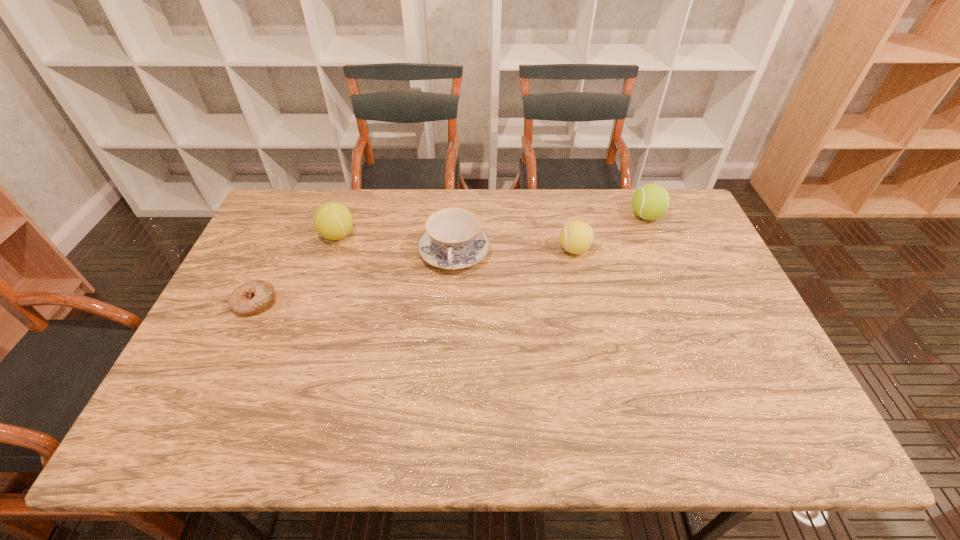
I want to click on vacant space in between the second object from left to right and the rightmost object, so click(x=492, y=226).

The image size is (960, 540). I want to click on blank region between the fourth object from left to right and the leftmost object, so (415, 276).

The width and height of the screenshot is (960, 540). Identify the location of vacant point located between the second tennis ball from right to left and the rightmost object. (610, 233).

You are a GUI agent. You are given a task and a screenshot of the screen. Output one action in this format:
    pyautogui.click(x=<x>, y=<y>)
    Task: Click on the empty space between the second object from right to left and the shortest object
    The image size is (960, 540).
    Given the screenshot: What is the action you would take?
    pyautogui.click(x=415, y=276)

This screenshot has width=960, height=540. Find the location of `free area in between the fourth object from right to left and the third object from left to right`. free area in between the fourth object from right to left and the third object from left to right is located at coordinates (396, 244).

You are a GUI agent. You are given a task and a screenshot of the screen. Output one action in this format:
    pyautogui.click(x=<x>, y=<y>)
    Task: Click on the vacant space that is in between the leftmost object and the fourth object from left to right
    Image resolution: width=960 pixels, height=540 pixels.
    Given the screenshot: What is the action you would take?
    pyautogui.click(x=415, y=276)

Locate an element on the screen. The height and width of the screenshot is (540, 960). object that is the closest one to the fourth object from right to left is located at coordinates (256, 296).

Select which object appears as the closest to the leftmost tennis ball. Please provide its 2D coordinates. Your answer should be formatted as a tuple, i.e. [(x, y)], where the tuple contains the x and y coordinates of a point satisfying the conditions above.

[(256, 296)]

The image size is (960, 540). I want to click on tennis ball that is the second closest to the second object from right to left, so click(333, 221).

This screenshot has height=540, width=960. What are the coordinates of `the closest tennis ball to the chinaware` in the screenshot? It's located at (333, 221).